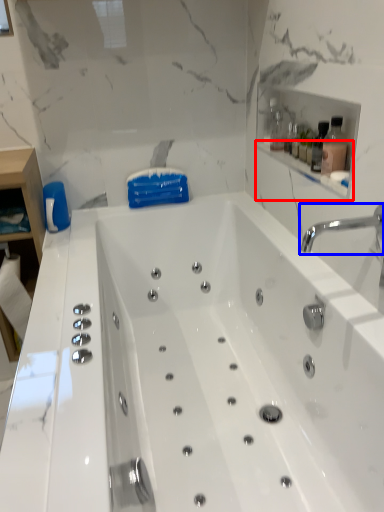
Question: Which object appears farthest to the camera in this image, balustrade (highlighted by a red box) or tap (highlighted by a blue box)?

Choices:
 (A) balustrade
 (B) tap

Answer: (A)